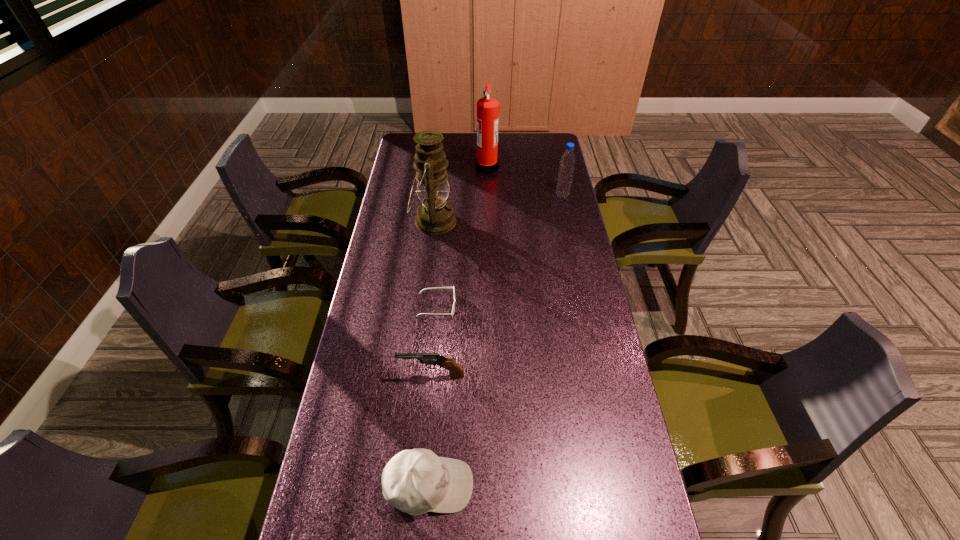
In order to click on free space between the third tallest object and the second nearest object in this screenshot , I will do `click(497, 286)`.

You are a GUI agent. You are given a task and a screenshot of the screen. Output one action in this format:
    pyautogui.click(x=<x>, y=<y>)
    Task: Click on the unoccupied position between the fire extinguisher and the second nearest object
    
    Given the screenshot: What is the action you would take?
    (x=460, y=272)

Locate an element on the screen. The height and width of the screenshot is (540, 960). empty location between the fourth nearest object and the fire extinguisher is located at coordinates (460, 194).

Image resolution: width=960 pixels, height=540 pixels. Find the location of `free space between the second nearest object and the oil lamp`. free space between the second nearest object and the oil lamp is located at coordinates (433, 299).

I want to click on free space between the nearest object and the fire extinguisher, so click(x=458, y=326).

Where is `vacant area that lies between the gun and the baseball cap`? This screenshot has width=960, height=540. vacant area that lies between the gun and the baseball cap is located at coordinates pyautogui.click(x=431, y=431).

Locate an element on the screen. The width and height of the screenshot is (960, 540). free space between the fifth farthest object and the baseball cap is located at coordinates (431, 431).

Identify which object is the fifth nearest to the baseball cap. Please provide its 2D coordinates. Your answer should be formatted as a tuple, i.e. [(x, y)], where the tuple contains the x and y coordinates of a point satisfying the conditions above.

[(488, 108)]

Identify which object is located as the fourth nearest to the fifth farthest object. Please provide its 2D coordinates. Your answer should be formatted as a tuple, i.e. [(x, y)], where the tuple contains the x and y coordinates of a point satisfying the conditions above.

[(567, 161)]

Find the location of a particular element. vacant space that satisfies the following two spatial constraints: 1. with the lenses of the sunglasses facing outward; 2. along the barrel of the second nearest object is located at coordinates (430, 376).